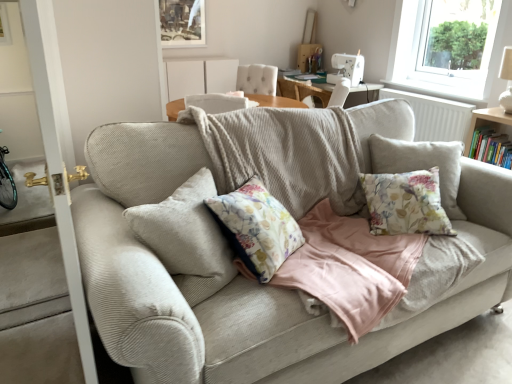
Question: Can you confirm if white textured radiator at upper right is wider than transparent glass window at upper right?

Choices:
 (A) yes
 (B) no

Answer: (B)

Question: From a real-world perspective, is white textured radiator at upper right positioned under transparent glass window at upper right based on gravity?

Choices:
 (A) no
 (B) yes

Answer: (B)

Question: Is white textured radiator at upper right far from transparent glass window at upper right?

Choices:
 (A) yes
 (B) no

Answer: (A)

Question: Is white textured radiator at upper right at the left side of transparent glass window at upper right?

Choices:
 (A) yes
 (B) no

Answer: (A)

Question: Does white textured radiator at upper right appear on the right side of transparent glass window at upper right?

Choices:
 (A) no
 (B) yes

Answer: (A)

Question: Can you confirm if white textured radiator at upper right is thinner than transparent glass window at upper right?

Choices:
 (A) no
 (B) yes

Answer: (B)

Question: Does matte wooden picture frame at upper center appear on the left side of corduroy couch at center?

Choices:
 (A) no
 (B) yes

Answer: (B)

Question: From the image's perspective, is matte wooden picture frame at upper center on top of corduroy couch at center?

Choices:
 (A) no
 (B) yes

Answer: (B)

Question: Does matte wooden picture frame at upper center have a smaller size compared to corduroy couch at center?

Choices:
 (A) no
 (B) yes

Answer: (B)

Question: Does matte wooden picture frame at upper center lie behind corduroy couch at center?

Choices:
 (A) yes
 (B) no

Answer: (A)

Question: From a real-world perspective, is matte wooden picture frame at upper center over corduroy couch at center?

Choices:
 (A) yes
 (B) no

Answer: (A)

Question: Is matte wooden picture frame at upper center not close to corduroy couch at center?

Choices:
 (A) no
 (B) yes

Answer: (B)

Question: Considering the relative positions of transparent glass window at upper right and matte wooden picture frame at upper center in the image provided, is transparent glass window at upper right in front of matte wooden picture frame at upper center?

Choices:
 (A) no
 (B) yes

Answer: (B)